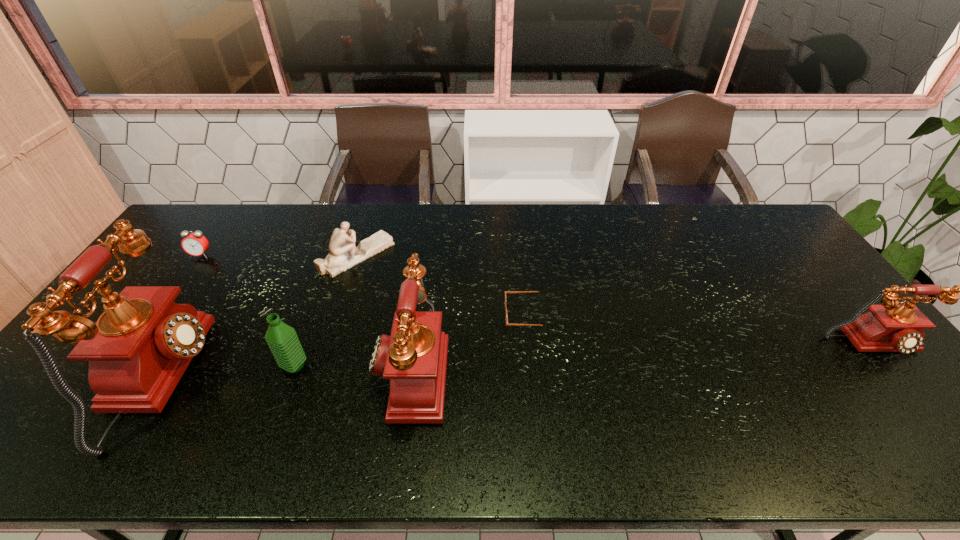
Locate an element on the screen. Image resolution: width=960 pixels, height=540 pixels. the leftmost telephone is located at coordinates (139, 348).

Where is `the fifth object from left to right`? the fifth object from left to right is located at coordinates (415, 354).

At what (x,y) coordinates should I click in order to perform the action: click on the sixth shortest object. Please return your answer as a coordinate pair (x, y). Looking at the image, I should click on pyautogui.click(x=415, y=354).

Image resolution: width=960 pixels, height=540 pixels. Identify the location of the rightmost telephone. (889, 327).

Where is `the rightmost object`? the rightmost object is located at coordinates (889, 327).

Image resolution: width=960 pixels, height=540 pixels. What are the coordinates of `the second shortest object` in the screenshot? It's located at (195, 244).

Where is `figurine`? figurine is located at coordinates (343, 255).

The image size is (960, 540). Find the location of `water bottle`. water bottle is located at coordinates (281, 338).

This screenshot has width=960, height=540. In order to click on sunglasses in this screenshot , I will do `click(506, 317)`.

The width and height of the screenshot is (960, 540). Find the location of `the sixth object from left to right`. the sixth object from left to right is located at coordinates (506, 317).